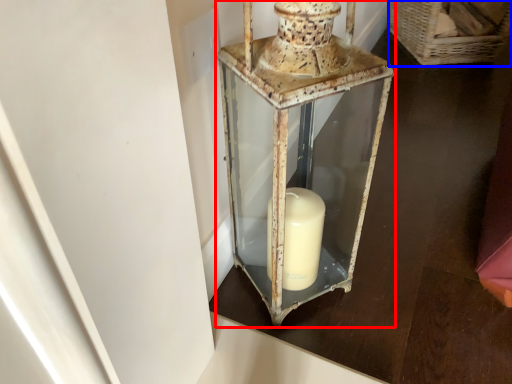
Question: Which of the following is the closest to the observer, lantern (highlighted by a red box) or basket (highlighted by a blue box)?

Choices:
 (A) lantern
 (B) basket

Answer: (A)